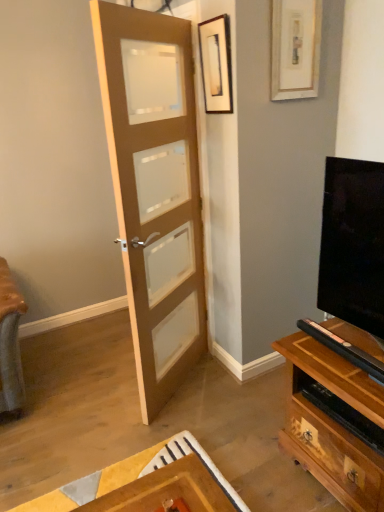
Find the location of a particular element. The image size is (384, 512). vacant space that is to the left of matte wood door at center is located at coordinates (98, 392).